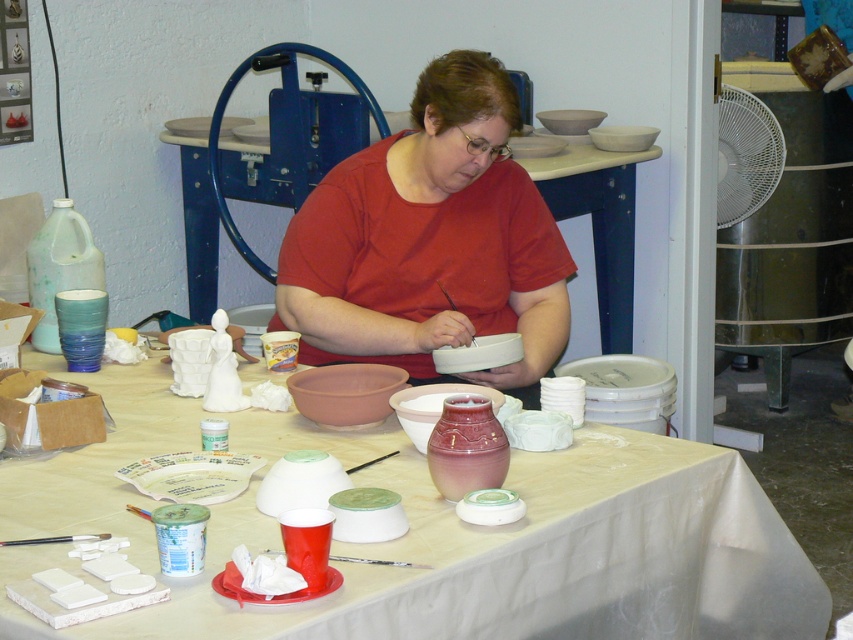
You are standing in the pottery workshop and want to place a new ceramic bowl on the white matte table at center. However, there is a matte red shirt at center in the way. Which object should you move to access the table?

You should move the matte red shirt at center because it is closer to you than the white matte table at center, so it is blocking your access to the table.

You are a photographer standing at a certain position. You want to take a closeup shot of the matte red shirt at center. What is the minimum distance you need to move forward to ensure the shirt fills the frame?

The minimum distance to move forward is 0.20 meters because the current distance between the matte red shirt at center and the camera is 2.20 meters. To get closer, you need to reduce this distance by at least 2.00 meters to fill the frame, but since you can only move forward, subtracting 2.00 from 2.20 gives 0.20 meters remaining distance.